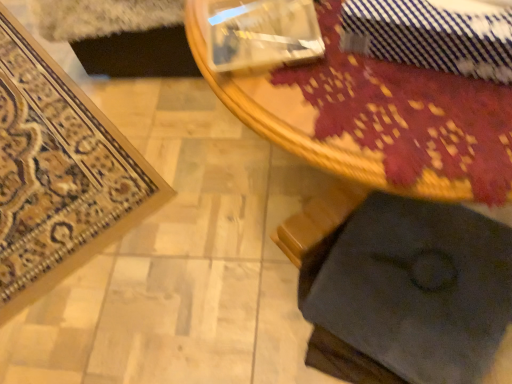
Question: Is wooden table at center to the right of blue striped tie at upper right from the viewer's perspective?

Choices:
 (A) yes
 (B) no

Answer: (A)

Question: Considering the relative sizes of wooden table at center and blue striped tie at upper right in the image provided, is wooden table at center wider than blue striped tie at upper right?

Choices:
 (A) yes
 (B) no

Answer: (A)

Question: Considering the relative positions of wooden table at center and blue striped tie at upper right in the image provided, is wooden table at center to the left of blue striped tie at upper right from the viewer's perspective?

Choices:
 (A) yes
 (B) no

Answer: (B)

Question: Would you say wooden table at center contains blue striped tie at upper right?

Choices:
 (A) no
 (B) yes

Answer: (A)

Question: Is wooden table at center bigger than blue striped tie at upper right?

Choices:
 (A) no
 (B) yes

Answer: (B)

Question: From the image's perspective, is wooden table at center located beneath blue striped tie at upper right?

Choices:
 (A) yes
 (B) no

Answer: (A)

Question: Is dark fabric cushion at lower right looking in the opposite direction of wooden table at center?

Choices:
 (A) no
 (B) yes

Answer: (B)

Question: Can you confirm if dark fabric cushion at lower right is thinner than wooden table at center?

Choices:
 (A) yes
 (B) no

Answer: (A)

Question: Does dark fabric cushion at lower right come in front of wooden table at center?

Choices:
 (A) yes
 (B) no

Answer: (B)

Question: Does dark fabric cushion at lower right have a larger size compared to wooden table at center?

Choices:
 (A) yes
 (B) no

Answer: (B)

Question: Does dark fabric cushion at lower right come behind wooden table at center?

Choices:
 (A) yes
 (B) no

Answer: (A)

Question: Does dark fabric cushion at lower right have a greater height compared to wooden table at center?

Choices:
 (A) no
 (B) yes

Answer: (A)

Question: Does blue striped tie at upper right lie in front of wooden table at center?

Choices:
 (A) no
 (B) yes

Answer: (A)